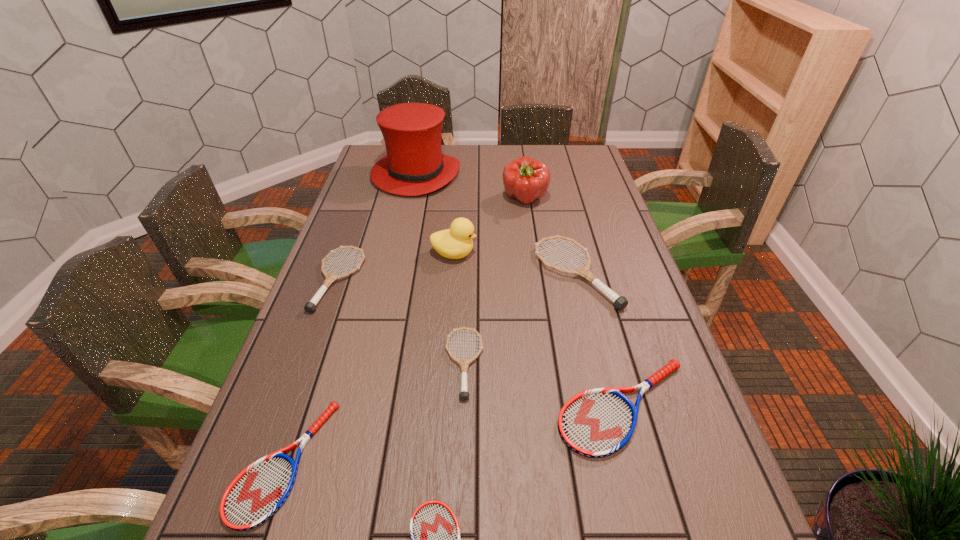
In order to click on the second gray tennis racket from left to right in this screenshot , I will do 464,363.

This screenshot has height=540, width=960. Find the location of `the rightmost blue tennis racket`. the rightmost blue tennis racket is located at coordinates tap(596, 423).

Where is `the second biggest blue tennis racket`? Image resolution: width=960 pixels, height=540 pixels. the second biggest blue tennis racket is located at coordinates (258, 492).

This screenshot has width=960, height=540. I want to click on the leftmost blue tennis racket, so pyautogui.click(x=258, y=492).

This screenshot has width=960, height=540. I want to click on vacant position located 0.090m on the front of the red hat, so click(x=408, y=213).

This screenshot has height=540, width=960. Identify the location of free space located on the front of the pepper. (533, 256).

Locate an element on the screen. This screenshot has height=540, width=960. vacant position located 0.330m on the front-facing side of the third tallest object is located at coordinates (585, 254).

Where is `free space located 0.280m on the front of the tallest tennis racket`? free space located 0.280m on the front of the tallest tennis racket is located at coordinates (608, 408).

The height and width of the screenshot is (540, 960). I want to click on vacant space located 0.350m on the right of the leftmost gray tennis racket, so click(484, 280).

Where is `free region located on the back of the smallest gray tennis racket`? This screenshot has height=540, width=960. free region located on the back of the smallest gray tennis racket is located at coordinates (467, 278).